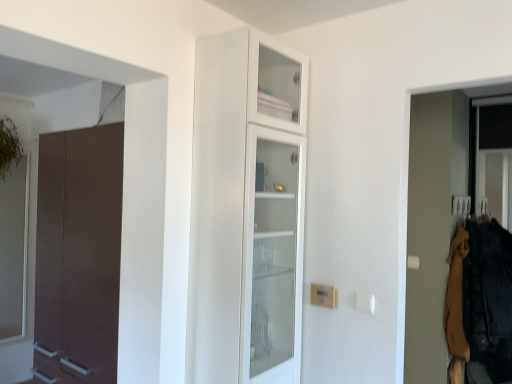
Question: From a real-world perspective, is brown woolen sweater at right, the second clothing viewed from the right, below dark brown fabric at right, arranged as the 2th clothing when viewed from the left?

Choices:
 (A) yes
 (B) no

Answer: (B)

Question: Considering the relative positions of brown woolen sweater at right, the first clothing when ordered from left to right, and dark brown fabric at right, arranged as the 2th clothing when viewed from the left, in the image provided, is brown woolen sweater at right, the first clothing when ordered from left to right, to the right of dark brown fabric at right, arranged as the 2th clothing when viewed from the left, from the viewer's perspective?

Choices:
 (A) yes
 (B) no

Answer: (B)

Question: Is brown woolen sweater at right, the first clothing when ordered from left to right, smaller than dark brown fabric at right, marked as the 1th clothing in a right-to-left arrangement?

Choices:
 (A) no
 (B) yes

Answer: (B)

Question: Considering the relative sizes of brown woolen sweater at right, the second clothing viewed from the right, and dark brown fabric at right, marked as the 1th clothing in a right-to-left arrangement, in the image provided, is brown woolen sweater at right, the second clothing viewed from the right, wider than dark brown fabric at right, marked as the 1th clothing in a right-to-left arrangement,?

Choices:
 (A) no
 (B) yes

Answer: (A)

Question: From the image's perspective, would you say brown woolen sweater at right, the second clothing viewed from the right, is positioned over dark brown fabric at right, marked as the 1th clothing in a right-to-left arrangement?

Choices:
 (A) no
 (B) yes

Answer: (B)

Question: In terms of width, does brown woolen sweater at right, the first clothing when ordered from left to right, look wider or thinner when compared to dark brown fabric at right, marked as the 1th clothing in a right-to-left arrangement?

Choices:
 (A) thin
 (B) wide

Answer: (A)

Question: Is brown woolen sweater at right, the second clothing viewed from the right, taller or shorter than dark brown fabric at right, marked as the 1th clothing in a right-to-left arrangement?

Choices:
 (A) tall
 (B) short

Answer: (B)

Question: From a real-world perspective, relative to dark brown fabric at right, marked as the 1th clothing in a right-to-left arrangement, is brown woolen sweater at right, the first clothing when ordered from left to right, vertically above or below?

Choices:
 (A) below
 (B) above

Answer: (B)

Question: Relative to dark brown fabric at right, arranged as the 2th clothing when viewed from the left, is brown woolen sweater at right, the second clothing viewed from the right, in front or behind?

Choices:
 (A) front
 (B) behind

Answer: (B)

Question: From a real-world perspective, is brown woolen sweater at right, the second clothing viewed from the right, physically located above or below white glass cabinet at center?

Choices:
 (A) above
 (B) below

Answer: (B)

Question: Considering the positions of brown woolen sweater at right, the second clothing viewed from the right, and white glass cabinet at center in the image, is brown woolen sweater at right, the second clothing viewed from the right, bigger or smaller than white glass cabinet at center?

Choices:
 (A) small
 (B) big

Answer: (A)

Question: From the image's perspective, is brown woolen sweater at right, the first clothing when ordered from left to right, located above or below white glass cabinet at center?

Choices:
 (A) above
 (B) below

Answer: (B)

Question: Is point (458, 236) closer or farther from the camera than point (202, 211)?

Choices:
 (A) closer
 (B) farther

Answer: (B)

Question: From the image's perspective, relative to dark brown fabric at right, marked as the 1th clothing in a right-to-left arrangement, is white glass cabinet at center above or below?

Choices:
 (A) above
 (B) below

Answer: (A)

Question: From a real-world perspective, is white glass cabinet at center physically located above or below dark brown fabric at right, marked as the 1th clothing in a right-to-left arrangement?

Choices:
 (A) below
 (B) above

Answer: (B)